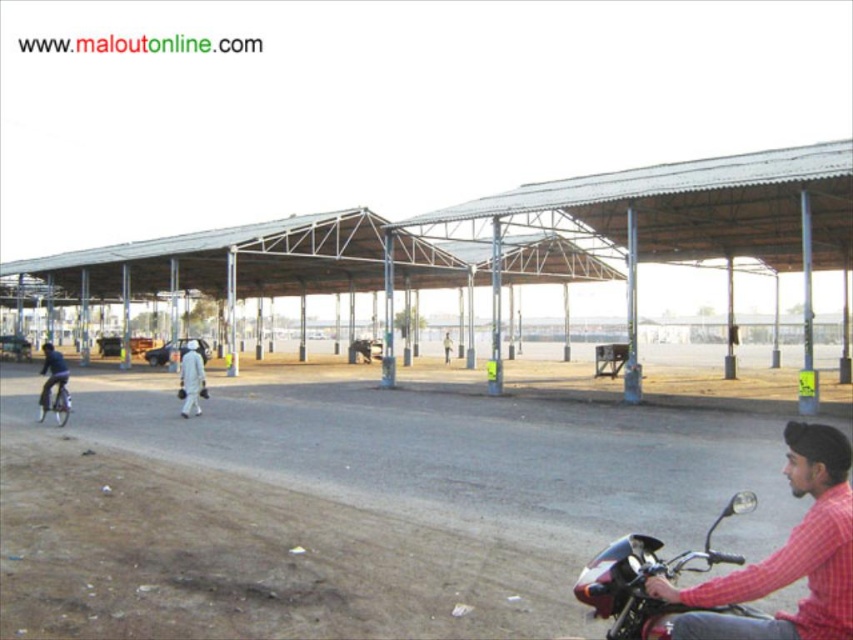
Who is more forward, (730, 557) or (51, 404)?

Point (730, 557)

Which is below, shiny black motorcycle at lower right or shiny metallic bicycle at left?

shiny metallic bicycle at left is lower down.

Where is `shiny black motorcycle at lower right`? The image size is (853, 640). shiny black motorcycle at lower right is located at coordinates (651, 576).

Is white matte clothing at center thinner than shiny metallic bicycle at left?

In fact, white matte clothing at center might be wider than shiny metallic bicycle at left.

Which is above, white matte clothing at center or shiny metallic bicycle at left?

Positioned higher is white matte clothing at center.

Does point (183, 353) come behind point (61, 390)?

Yes.

The width and height of the screenshot is (853, 640). Find the location of `white matte clothing at center`. white matte clothing at center is located at coordinates pyautogui.click(x=190, y=380).

Who is lower down, red checkered shirt at lower right or white matte clothing at center?

white matte clothing at center is lower down.

Which is in front, point (807, 525) or point (190, 355)?

Point (807, 525) is in front.

I want to click on red checkered shirt at lower right, so click(787, 556).